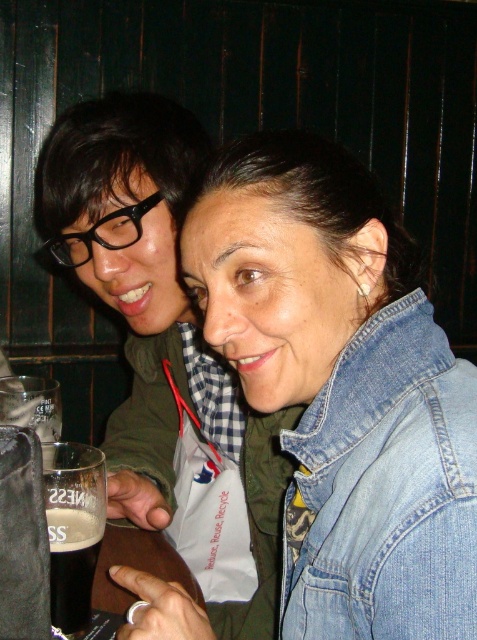
Question: Does denim jacket at lower right have a larger size compared to dark brown glass at lower left?

Choices:
 (A) no
 (B) yes

Answer: (B)

Question: Does denim jacket at lower right have a greater width compared to dark brown glass at lower left?

Choices:
 (A) yes
 (B) no

Answer: (A)

Question: Does denim jacket at lower right come behind dark brown glass at lower left?

Choices:
 (A) yes
 (B) no

Answer: (B)

Question: Which object is closer to the camera taking this photo?

Choices:
 (A) denim jacket at lower right
 (B) dark brown glass at lower left

Answer: (A)

Question: Among these objects, which one is farthest from the camera?

Choices:
 (A) dark brown glass at lower left
 (B) denim jacket at lower right

Answer: (A)